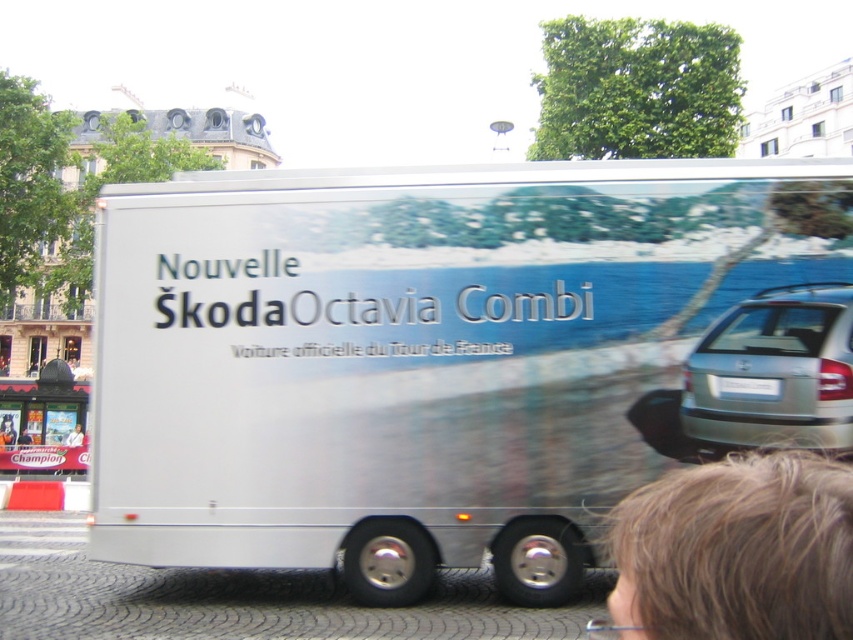
Is white metallic truck at center thinner than light brown hair at lower right?

No, white metallic truck at center is not thinner than light brown hair at lower right.

Does white metallic truck at center come in front of light brown hair at lower right?

Yes, white metallic truck at center is in front of light brown hair at lower right.

What are the coordinates of `white metallic truck at center` in the screenshot? It's located at (416, 355).

Where is `white metallic truck at center`? The height and width of the screenshot is (640, 853). white metallic truck at center is located at coordinates (416, 355).

Which is more to the right, blonde hair at lower right or smooth black hair at lower right?

blonde hair at lower right is more to the right.

Between blonde hair at lower right and smooth black hair at lower right, which one has more height?

A: blonde hair at lower right is taller.

This screenshot has width=853, height=640. What are the coordinates of `blonde hair at lower right` in the screenshot? It's located at (735, 552).

Is white matte bus at lower left shorter than smooth black hair at lower right?

No.

Between point (62, 448) and point (0, 440), which one is positioned behind?

The point (0, 440) is behind.

You are a GUI agent. You are given a task and a screenshot of the screen. Output one action in this format:
    pyautogui.click(x=<x>, y=<y>)
    Task: Click on the white matte bus at lower left
    The height and width of the screenshot is (640, 853).
    Given the screenshot: What is the action you would take?
    pyautogui.click(x=45, y=420)